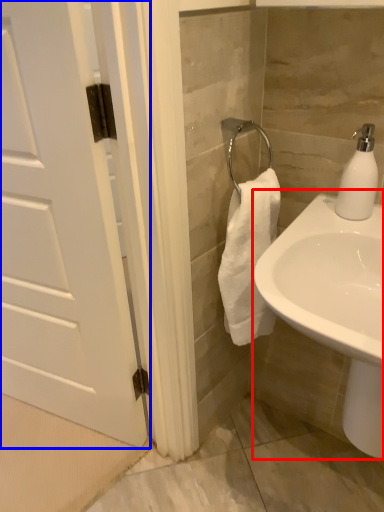
Question: Which object appears farthest to the camera in this image, sink (highlighted by a red box) or door (highlighted by a blue box)?

Choices:
 (A) sink
 (B) door

Answer: (B)